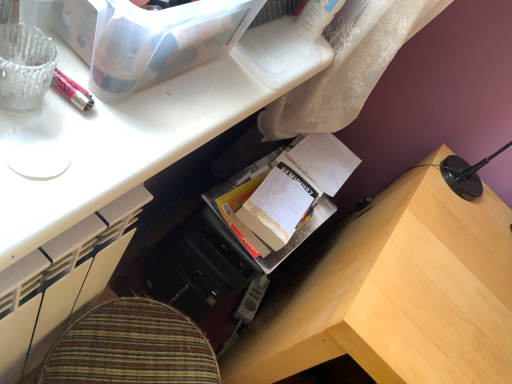
You are a GUI agent. You are given a task and a screenshot of the screen. Output one action in this format:
    pyautogui.click(x=<x>, y=<y>)
    Task: Click on the unoccupied region to the right of transparent plastic storage box at upper left
    
    Given the screenshot: What is the action you would take?
    pyautogui.click(x=207, y=99)